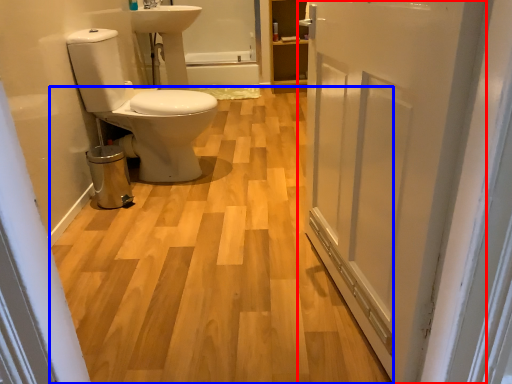
Question: Which object is closer to the camera taking this photo, door (highlighted by a red box) or plain (highlighted by a blue box)?

Choices:
 (A) door
 (B) plain

Answer: (A)